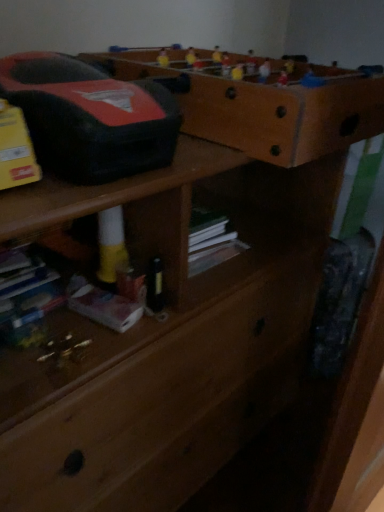
Image resolution: width=384 pixels, height=512 pixels. Describe the element at coordinates (262, 104) in the screenshot. I see `brown wooden shelf at upper center` at that location.

Describe the element at coordinates (167, 338) in the screenshot. This screenshot has width=384, height=512. I see `wooden chest of drawers at center` at that location.

Where is `brown wooden shelf at upper center`? brown wooden shelf at upper center is located at coordinates (262, 104).

Would you say white matte book at lower left is a long distance from brown wooden shelf at upper center?

white matte book at lower left is near brown wooden shelf at upper center, not far away.

From the image's perspective, between white matte book at lower left and brown wooden shelf at upper center, which one is located above?

brown wooden shelf at upper center appears higher in the image.

Considering the positions of point (32, 307) and point (314, 140), is point (32, 307) closer or farther from the camera than point (314, 140)?

Point (32, 307).

Based on the photo, is white matte book at lower left taller than brown wooden shelf at upper center?

In fact, white matte book at lower left may be shorter than brown wooden shelf at upper center.

Does point (238, 313) come farther from viewer compared to point (43, 314)?

Yes, it is.

Is wooden chest of drawers at center positioned beyond the bounds of white matte book at lower left?

wooden chest of drawers at center lies outside white matte book at lower left's area.

Looking at this image, which is more to the right, wooden chest of drawers at center or white matte book at lower left?

From the viewer's perspective, wooden chest of drawers at center appears more on the right side.

In the scene shown: From the image's perspective, is wooden chest of drawers at center under white matte book at lower left?

Yes.

Which point is more forward, (174, 218) or (190, 132)?

Positioned in front is point (174, 218).

From the picture: Which is more to the right, wooden chest of drawers at center or brown wooden shelf at upper center?

Positioned to the right is brown wooden shelf at upper center.

Is wooden chest of drawers at center positioned with its back to brown wooden shelf at upper center?

wooden chest of drawers at center does not have its back to brown wooden shelf at upper center.

Which is more distant, (127, 74) or (260, 385)?

The point (260, 385) is more distant.

Can you confirm if brown wooden shelf at upper center is smaller than wooden chest of drawers at center?

Correct, brown wooden shelf at upper center occupies less space than wooden chest of drawers at center.

Which object is further away from the camera, brown wooden shelf at upper center or wooden chest of drawers at center?

brown wooden shelf at upper center is further from the camera.

In terms of height, does brown wooden shelf at upper center look taller or shorter compared to wooden chest of drawers at center?

brown wooden shelf at upper center is shorter than wooden chest of drawers at center.

From the picture: From the image's perspective, which is above, white matte book at lower left or wooden chest of drawers at center?

white matte book at lower left is shown above in the image.

Between white matte book at lower left and wooden chest of drawers at center, which one has more height?

wooden chest of drawers at center is taller.

From the picture: Who is more distant, white matte book at lower left or wooden chest of drawers at center?

white matte book at lower left is further from the camera.

Is white matte book at lower left situated inside wooden chest of drawers at center or outside?

white matte book at lower left is contained in wooden chest of drawers at center.

Is brown wooden shelf at upper center in front of or behind white matte book at lower left in the image?

brown wooden shelf at upper center is in front of white matte book at lower left.

Considering the relative positions of brown wooden shelf at upper center and white matte book at lower left in the image provided, is brown wooden shelf at upper center to the right of white matte book at lower left from the viewer's perspective?

Indeed, brown wooden shelf at upper center is positioned on the right side of white matte book at lower left.

Considering the sizes of objects brown wooden shelf at upper center and white matte book at lower left in the image provided, who is bigger, brown wooden shelf at upper center or white matte book at lower left?

brown wooden shelf at upper center is bigger.

Is brown wooden shelf at upper center situated inside white matte book at lower left or outside?

brown wooden shelf at upper center is spatially situated outside white matte book at lower left.

Image resolution: width=384 pixels, height=512 pixels. I want to click on shelf located above the white matte book at lower left (from a real-world perspective), so click(262, 104).

Find the location of a particular element. This screenshot has width=384, height=512. book behind the wooden chest of drawers at center is located at coordinates (29, 293).

Looking at the image, which one is located further to white matte book at lower left, brown wooden shelf at upper center or wooden chest of drawers at center?

Among the two, brown wooden shelf at upper center is located further to white matte book at lower left.

From the image, which object appears to be farther from wooden chest of drawers at center, brown wooden shelf at upper center or white matte book at lower left?

white matte book at lower left is positioned further to the anchor wooden chest of drawers at center.

Based on their spatial positions, is white matte book at lower left or wooden chest of drawers at center further from brown wooden shelf at upper center?

white matte book at lower left lies further to brown wooden shelf at upper center than the other object.

Based on their spatial positions, is white matte book at lower left or brown wooden shelf at upper center closer to wooden chest of drawers at center?

Based on the image, brown wooden shelf at upper center appears to be nearer to wooden chest of drawers at center.

Estimate the real-world distances between objects in this image. Which object is further from white matte book at lower left, wooden chest of drawers at center or brown wooden shelf at upper center?

brown wooden shelf at upper center.

Estimate the real-world distances between objects in this image. Which object is closer to brown wooden shelf at upper center, wooden chest of drawers at center or white matte book at lower left?

The object closer to brown wooden shelf at upper center is wooden chest of drawers at center.

I want to click on book between brown wooden shelf at upper center and wooden chest of drawers at center in the vertical direction, so click(29, 293).